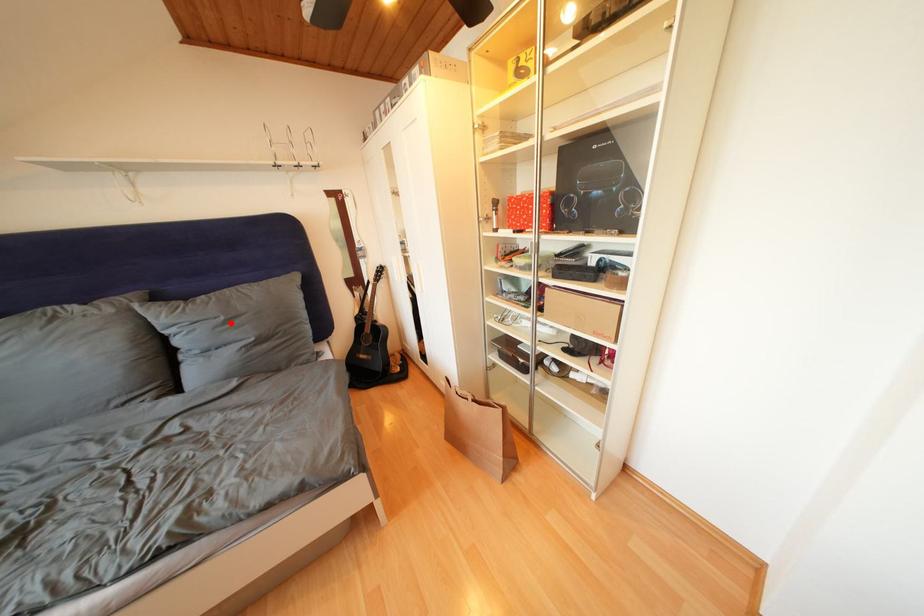
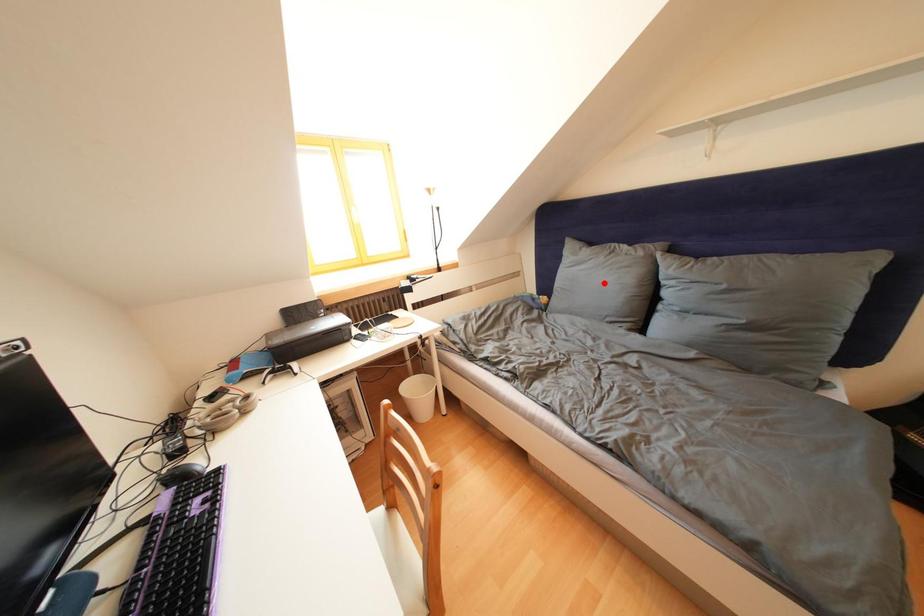
I am providing you with two images of the same scene from different viewpoints. A red point is marked on the first image and another point is marked on the second image. Are the points marked in image1 and image2 representing the same 3D position?

No